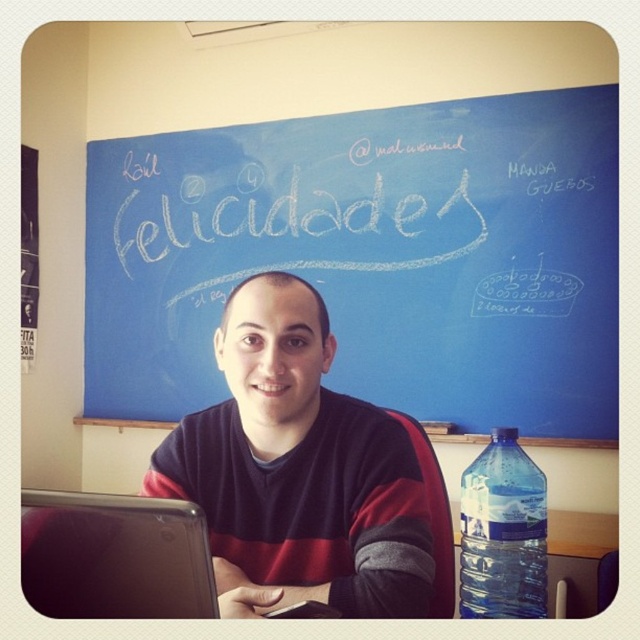
Does translucent plastic water bottle at right have a lesser height compared to translucent plastic table at lower right?

Yes, translucent plastic water bottle at right is shorter than translucent plastic table at lower right.

From the picture: Between translucent plastic water bottle at right and translucent plastic table at lower right, which one appears on the right side from the viewer's perspective?

translucent plastic table at lower right

Which is in front, point (484, 611) or point (458, 563)?

Point (484, 611) is in front.

This screenshot has height=640, width=640. Identify the location of translucent plastic water bottle at right. (500, 579).

Is point (452, 252) closer to viewer compared to point (236, 374)?

No, it is behind (236, 374).

Can you confirm if blue chalkboard at upper center is positioned below striped sweater at center?

Actually, blue chalkboard at upper center is above striped sweater at center.

Which is in front, point (506, 403) or point (420, 440)?

Point (420, 440) is more forward.

Identify the location of blue chalkboard at upper center. (372, 257).

Does blue chalkboard at upper center appear over translucent plastic water bottle at right?

Indeed, blue chalkboard at upper center is positioned over translucent plastic water bottle at right.

You are a GUI agent. You are given a task and a screenshot of the screen. Output one action in this format:
    pyautogui.click(x=<x>, y=<y>)
    Task: Click on the blue chalkboard at upper center
    Image resolution: width=640 pixels, height=640 pixels.
    Given the screenshot: What is the action you would take?
    pyautogui.click(x=372, y=257)

The height and width of the screenshot is (640, 640). What are the coordinates of `blue chalkboard at upper center` in the screenshot? It's located at (372, 257).